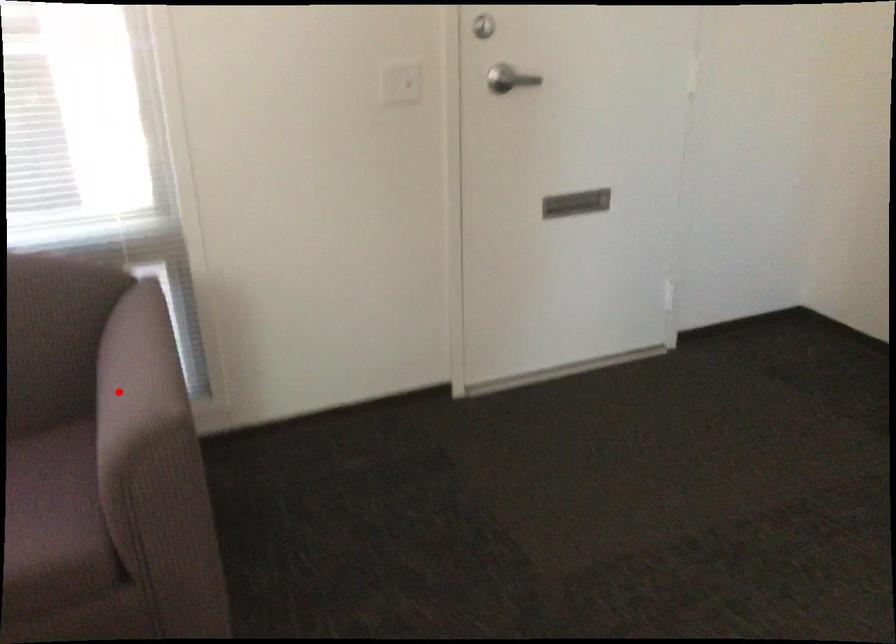
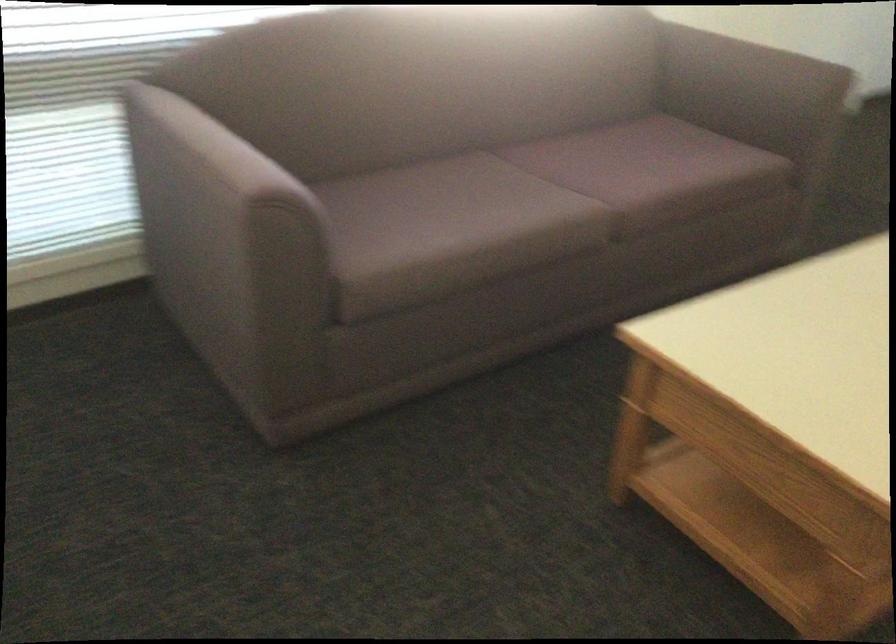
Locate, in the second image, the point that corresponds to the highlighted location in the first image.

(746, 73)